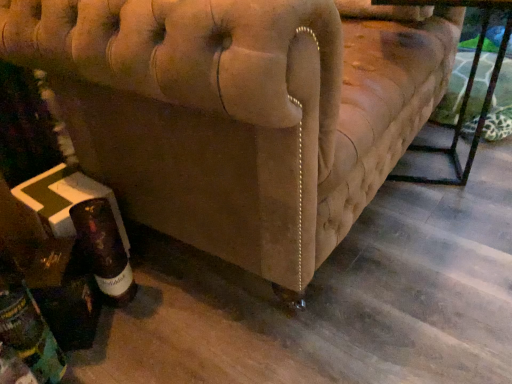
Find the location of a particular element. free point to the right of metallic black table at lower right is located at coordinates (475, 154).